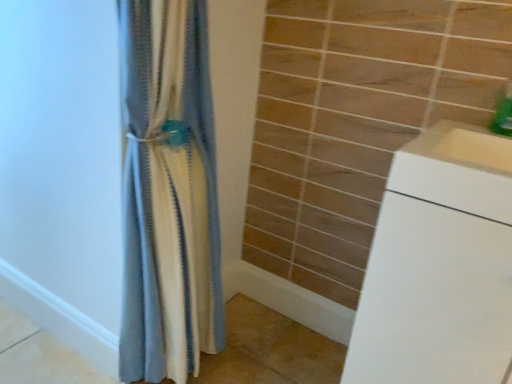
Question: Should I look upward or downward to see white glossy cabinet at lower right?

Choices:
 (A) up
 (B) down

Answer: (B)

Question: Is green plastic soap dispenser at upper right located outside white glossy cabinet at lower right?

Choices:
 (A) yes
 (B) no

Answer: (A)

Question: Is green plastic soap dispenser at upper right oriented away from white glossy cabinet at lower right?

Choices:
 (A) yes
 (B) no

Answer: (B)

Question: Can you confirm if green plastic soap dispenser at upper right is shorter than white glossy cabinet at lower right?

Choices:
 (A) no
 (B) yes

Answer: (B)

Question: Is green plastic soap dispenser at upper right at the left side of white glossy cabinet at lower right?

Choices:
 (A) no
 (B) yes

Answer: (A)

Question: Does green plastic soap dispenser at upper right have a greater height compared to white glossy cabinet at lower right?

Choices:
 (A) yes
 (B) no

Answer: (B)

Question: Does green plastic soap dispenser at upper right lie in front of white glossy cabinet at lower right?

Choices:
 (A) yes
 (B) no

Answer: (B)

Question: From a real-world perspective, is white glossy cabinet at lower right positioned under white matte drawer at right based on gravity?

Choices:
 (A) no
 (B) yes

Answer: (B)

Question: Considering the relative positions of white glossy cabinet at lower right and white matte drawer at right in the image provided, is white glossy cabinet at lower right in front of white matte drawer at right?

Choices:
 (A) yes
 (B) no

Answer: (A)

Question: Is white glossy cabinet at lower right wider than white matte drawer at right?

Choices:
 (A) no
 (B) yes

Answer: (B)

Question: Can you confirm if white glossy cabinet at lower right is smaller than white matte drawer at right?

Choices:
 (A) yes
 (B) no

Answer: (B)

Question: From a real-world perspective, does white glossy cabinet at lower right stand above white matte drawer at right?

Choices:
 (A) no
 (B) yes

Answer: (A)

Question: Could white matte drawer at right be considered to be inside white glossy cabinet at lower right?

Choices:
 (A) no
 (B) yes

Answer: (A)

Question: Does white matte drawer at right have a greater width compared to green plastic soap dispenser at upper right?

Choices:
 (A) yes
 (B) no

Answer: (A)